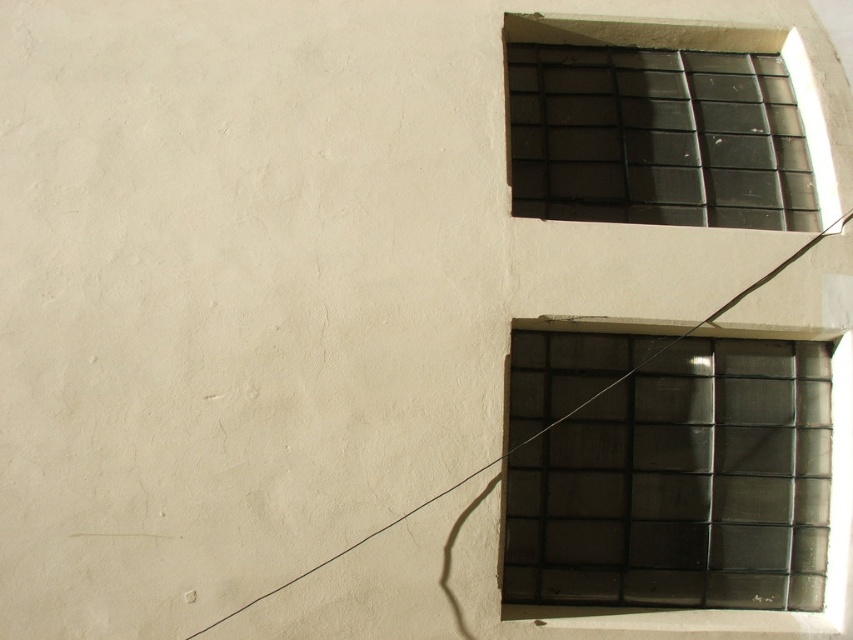
You are standing in front of the building wall with two windows. There are two points marked on the wall at coordinates point (642, 518) and point (508, 17). From your perspective, which point is closer to you?

Point (642, 518) is in front of point (508, 17), so it is closer to you.

You are a window installer who needs to ensure there is enough space between the transparent glass window at upper right and the black glass window at upper right to install a new security bar. The security bar requires at least 2 meters of space between them. Can you install the security bar between them?

The transparent glass window at upper right and black glass window at upper right are 2.05 meters apart, which is just enough space to install the security bar since it requires at least 2 meters.